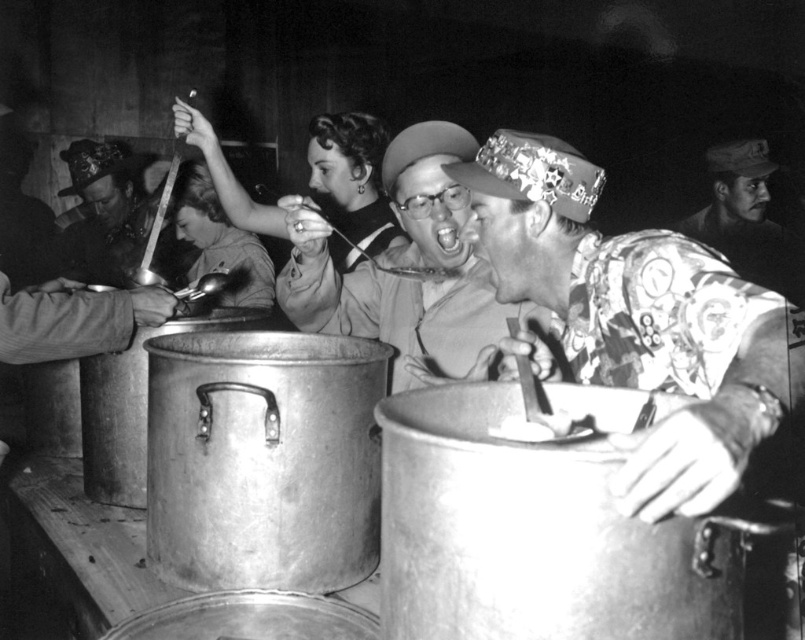
You are a photographer reviewing this black and white image. You notice the printed fabric shirt at center and the shiny silver spoon at left. Based on their positions, which object is closer to the right edge of the photo?

The printed fabric shirt at center is closer to the right edge of the photo because it is positioned to the right of the shiny silver spoon at left.

You are taking a photo of the communal dining scene. You want to focus on the point at the bottom of the image. Which point, point at (312, 205) or point at (100, 173), is closer to the camera and should be in focus?

Point at (312, 205) is closer to the camera than point at (100, 173), so it should be the one in focus.